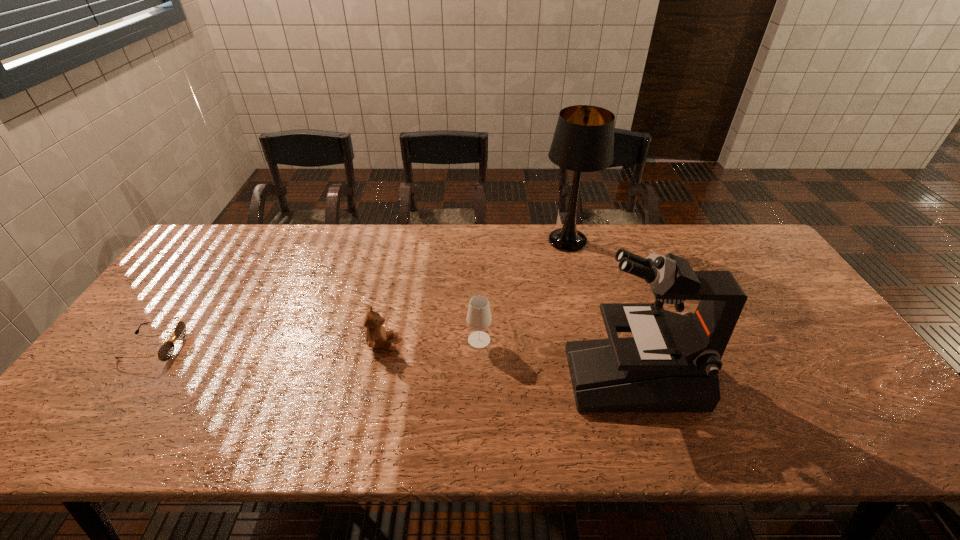
This screenshot has height=540, width=960. In order to click on the farthest object in this screenshot , I will do `click(583, 141)`.

The image size is (960, 540). I want to click on microscope, so click(671, 363).

Where is `glass`? This screenshot has width=960, height=540. glass is located at coordinates (479, 318).

Identify the location of teddy bear. (376, 337).

Where is `the second object from left to right`? The image size is (960, 540). the second object from left to right is located at coordinates (376, 337).

Find the location of a particular element. sunglasses is located at coordinates (165, 352).

The image size is (960, 540). Find the location of `the shortest object`. the shortest object is located at coordinates (165, 352).

The width and height of the screenshot is (960, 540). What are the coordinates of `vacant space located on the left of the table lamp` in the screenshot? It's located at (461, 241).

Locate an element on the screen. This screenshot has width=960, height=540. vacant region located through the eyepieces of the microscope is located at coordinates click(x=501, y=377).

You are a GUI agent. You are given a task and a screenshot of the screen. Output one action in this format:
    pyautogui.click(x=<x>, y=<y>)
    Task: Click on the free space located 0.070m through the eyepieces of the microscope
    The image size is (960, 540).
    Given the screenshot: What is the action you would take?
    coord(541,377)